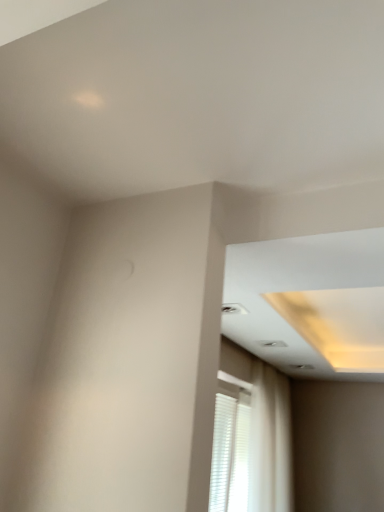
Describe the element at coordinates (230, 449) in the screenshot. I see `white matte blinds at lower right` at that location.

I want to click on white matte blinds at lower right, so click(230, 449).

Measure the distance between white sheer curtain at lower right and camera.

white sheer curtain at lower right and camera are 9.90 feet apart.

Locate an element on the screen. The height and width of the screenshot is (512, 384). white sheer curtain at lower right is located at coordinates (270, 442).

Describe the element at coordinates (270, 442) in the screenshot. I see `white sheer curtain at lower right` at that location.

Identify the location of white matte blinds at lower right. tap(230, 449).

Is white matte blinds at lower right at the left side of white sheer curtain at lower right?

Yes, white matte blinds at lower right is to the left of white sheer curtain at lower right.

Considering the positions of objects white matte blinds at lower right and white sheer curtain at lower right in the image provided, who is in front, white matte blinds at lower right or white sheer curtain at lower right?

white matte blinds at lower right is more forward.

Considering the points (232, 412) and (260, 446), which point is in front, point (232, 412) or point (260, 446)?

Positioned in front is point (232, 412).

From the image's perspective, which is below, white matte blinds at lower right or white sheer curtain at lower right?

white sheer curtain at lower right.

From a real-world perspective, is white matte blinds at lower right beneath white sheer curtain at lower right?

Indeed, from a real-world perspective, white matte blinds at lower right is positioned beneath white sheer curtain at lower right.

Can you confirm if white matte blinds at lower right is thinner than white sheer curtain at lower right?

Yes.

In terms of height, does white matte blinds at lower right look taller or shorter compared to white sheer curtain at lower right?

white matte blinds at lower right is shorter than white sheer curtain at lower right.

Is white matte blinds at lower right bigger or smaller than white sheer curtain at lower right?

Clearly, white matte blinds at lower right is smaller in size than white sheer curtain at lower right.

Consider the image. Is white matte blinds at lower right surrounding white sheer curtain at lower right?

No.

Based on the photo, is white matte blinds at lower right positioned far away from white sheer curtain at lower right?

That's not correct — white matte blinds at lower right is a little close to white sheer curtain at lower right.

Could you tell me if white matte blinds at lower right is turned towards white sheer curtain at lower right?

Yes, white matte blinds at lower right faces towards white sheer curtain at lower right.

How different are the orientations of white matte blinds at lower right and white sheer curtain at lower right in degrees?

0.428 degrees.

Where is `window above the white sheer curtain at lower right (from the image's perspective)`? Image resolution: width=384 pixels, height=512 pixels. window above the white sheer curtain at lower right (from the image's perspective) is located at coordinates (230, 449).

Considering the positions of objects white sheer curtain at lower right and white matte blinds at lower right in the image provided, who is more to the right, white sheer curtain at lower right or white matte blinds at lower right?

Positioned to the right is white sheer curtain at lower right.

Which is in front, white sheer curtain at lower right or white matte blinds at lower right?

white matte blinds at lower right is in front.

Is point (256, 360) less distant than point (221, 412)?

That is False.

From the image's perspective, is white sheer curtain at lower right located above white matte blinds at lower right?

No, from the image's perspective, white sheer curtain at lower right is not above white matte blinds at lower right.

From a real-world perspective, which is physically below, white sheer curtain at lower right or white matte blinds at lower right?

white matte blinds at lower right, from a real-world perspective.

Can you confirm if white sheer curtain at lower right is wider than white matte blinds at lower right?

Correct, the width of white sheer curtain at lower right exceeds that of white matte blinds at lower right.

Is white sheer curtain at lower right taller than white matte blinds at lower right?

Yes.

Between white sheer curtain at lower right and white matte blinds at lower right, which one has larger size?

white sheer curtain at lower right.

Is white sheer curtain at lower right not within white matte blinds at lower right?

Yes, white sheer curtain at lower right is not within white matte blinds at lower right.

Is white sheer curtain at lower right placed right next to white matte blinds at lower right?

They are not placed beside each other.

Is white matte blinds at lower right at the back of white sheer curtain at lower right?

Yes.

Can you tell me how much white sheer curtain at lower right and white matte blinds at lower right differ in facing direction?

white sheer curtain at lower right and white matte blinds at lower right are facing 0.428 degrees away from each other.

You are a GUI agent. You are given a task and a screenshot of the screen. Output one action in this format:
    pyautogui.click(x=<x>, y=<y>)
    Task: Click on the curtain located above the white matte blinds at lower right (from a real-world perspective)
    
    Given the screenshot: What is the action you would take?
    pyautogui.click(x=270, y=442)

Locate an element on the screen. curtain to the right of white matte blinds at lower right is located at coordinates (270, 442).

Locate an element on the screen. curtain behind the white matte blinds at lower right is located at coordinates (270, 442).